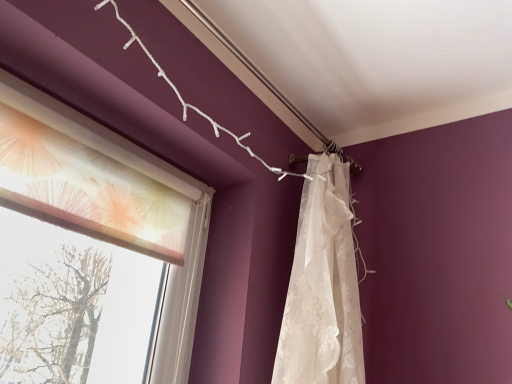
Question: In the image, is white lace curtain at upper right on the left side or the right side of translucent fabric at left?

Choices:
 (A) left
 (B) right

Answer: (B)

Question: Considering the positions of point (336, 374) and point (131, 160), is point (336, 374) closer or farther from the camera than point (131, 160)?

Choices:
 (A) farther
 (B) closer

Answer: (A)

Question: From the image's perspective, is white lace curtain at upper right positioned above or below translucent fabric at left?

Choices:
 (A) below
 (B) above

Answer: (A)

Question: Is point (42, 107) positioned closer to the camera than point (311, 319)?

Choices:
 (A) farther
 (B) closer

Answer: (B)

Question: In the image, is translucent fabric at left positioned in front of or behind white lace curtain at upper right?

Choices:
 (A) front
 (B) behind

Answer: (A)

Question: From the image's perspective, relative to white lace curtain at upper right, is translucent fabric at left above or below?

Choices:
 (A) below
 (B) above

Answer: (B)

Question: Is translucent fabric at left wider or thinner than white lace curtain at upper right?

Choices:
 (A) wide
 (B) thin

Answer: (B)